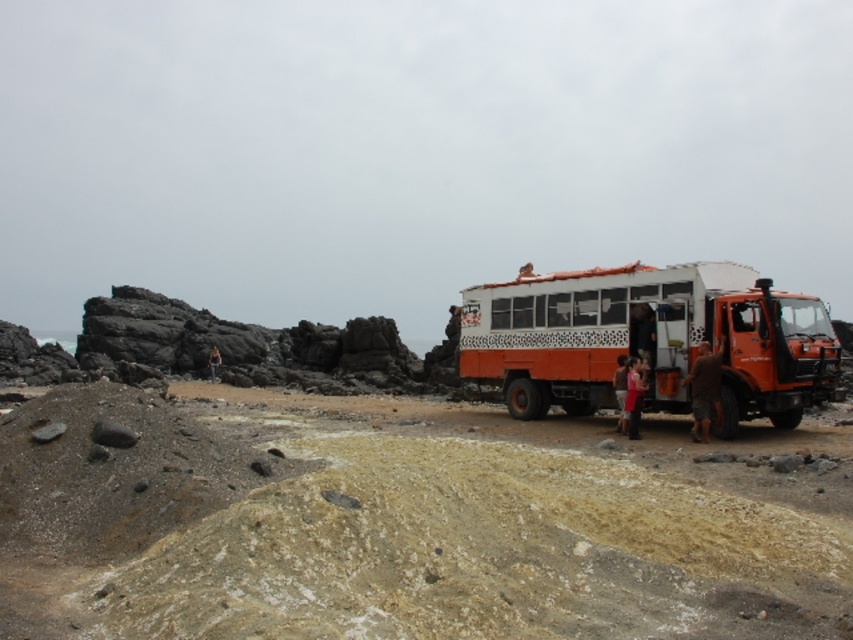
You are a photographer trying to capture both the orange matte truck at center and the red fabric shirt at center in a single frame. Based on their sizes, which object would appear wider in the photo?

The orange matte truck at center would appear wider in the photo since its width surpasses that of the red fabric shirt at center.